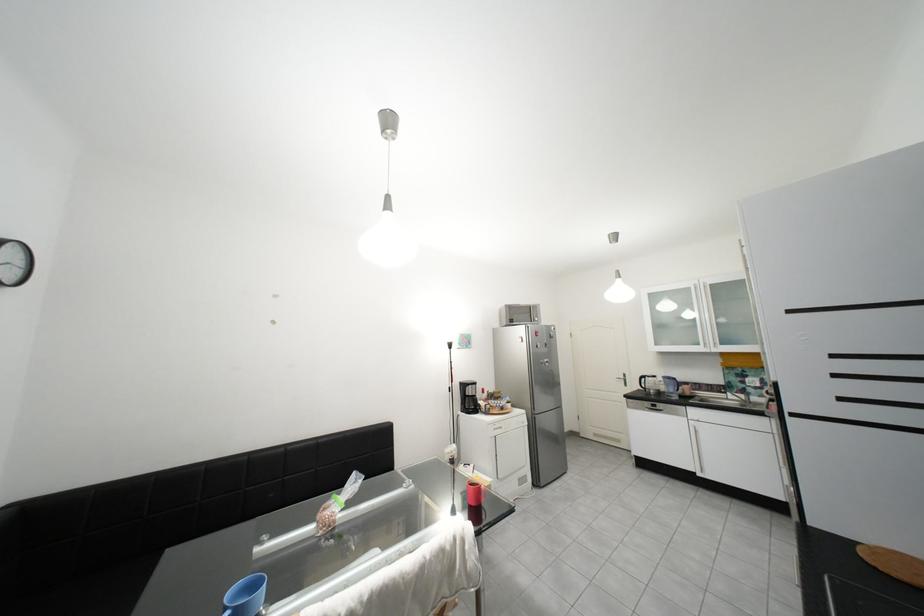
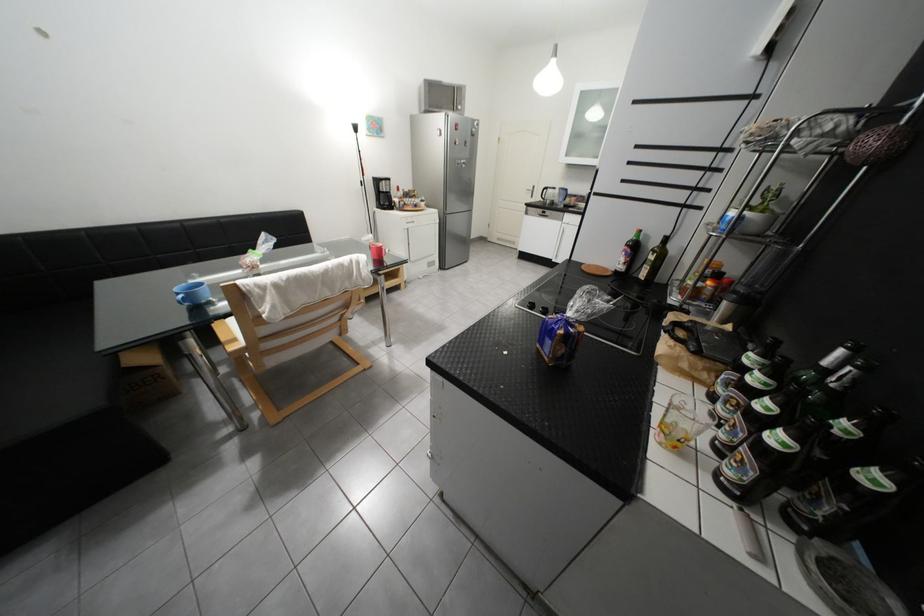
Based on the continuous images, in which direction is the camera rotating?

The camera rotated toward right-down.